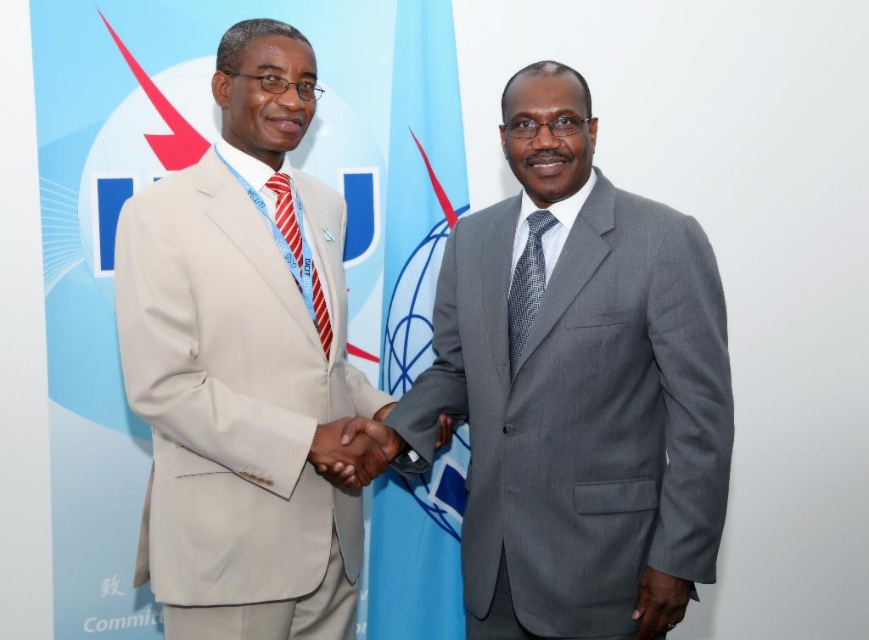
Is red striped tie at left further to camera compared to dark gray fabric hand at lower right?

That is True.

Which of these two, red striped tie at left or dark gray fabric hand at lower right, stands shorter?

With less height is dark gray fabric hand at lower right.

Identify the location of red striped tie at left. The height and width of the screenshot is (640, 869). (299, 253).

In the scene shown: Is smooth skin handshake at center above gray textured tie at center?

Actually, smooth skin handshake at center is below gray textured tie at center.

Can you confirm if smooth skin handshake at center is wider than gray textured tie at center?

Correct, the width of smooth skin handshake at center exceeds that of gray textured tie at center.

Is point (348, 472) positioned after point (542, 262)?

No, (348, 472) is in front of (542, 262).

At what (x,y) coordinates should I click in order to perform the action: click on smooth skin handshake at center. Please return your answer as a coordinate pair (x, y). Looking at the image, I should click on (353, 449).

Is point (637, 225) closer to viewer compared to point (512, 284)?

That is True.

Can you confirm if gray suit at center is bigger than gray textured tie at center?

Yes, gray suit at center is bigger than gray textured tie at center.

Does point (450, 308) come behind point (519, 292)?

Yes, point (450, 308) is behind point (519, 292).

At what (x,y) coordinates should I click in order to perform the action: click on gray suit at center. Please return your answer as a coordinate pair (x, y). The image size is (869, 640). Looking at the image, I should click on (576, 387).